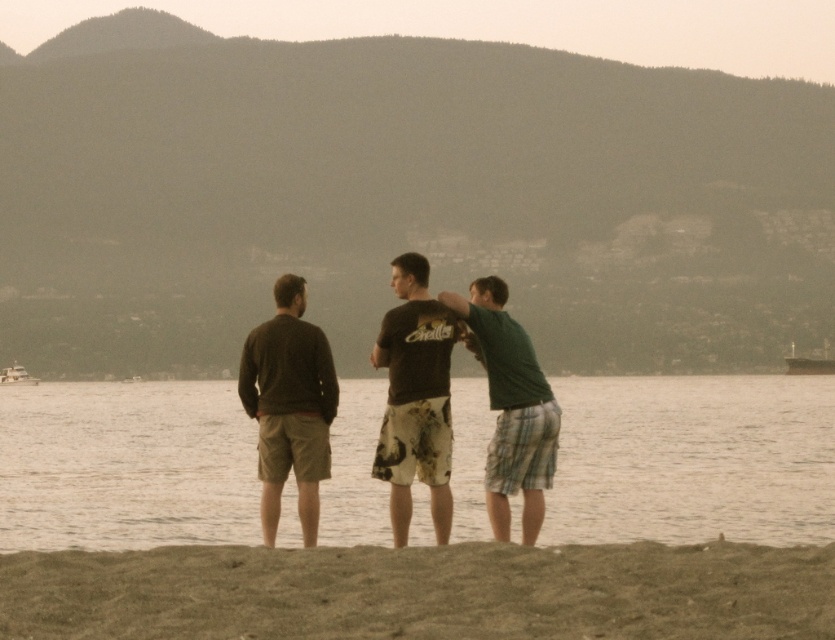
Looking at this image, is smooth water at center smaller than dark brown sweater at center?

Incorrect, smooth water at center is not smaller in size than dark brown sweater at center.

Does smooth water at center appear on the left side of dark brown sweater at center?

Yes, smooth water at center is to the left of dark brown sweater at center.

From the picture: Who is more distant from viewer, (x=735, y=500) or (x=301, y=364)?

Positioned behind is point (x=735, y=500).

Where is `smooth water at center`? The height and width of the screenshot is (640, 835). smooth water at center is located at coordinates (692, 460).

Who is more distant from viewer, (19, 433) or (444, 339)?

Positioned behind is point (19, 433).

Can you confirm if smooth water at center is wider than dark brown cotton t-shirt at center?

Yes.

Does point (347, 397) lie in front of point (423, 291)?

That is False.

Where is `smooth water at center`? The image size is (835, 640). smooth water at center is located at coordinates (692, 460).

You are a GUI agent. You are given a task and a screenshot of the screen. Output one action in this format:
    pyautogui.click(x=<x>, y=<y>)
    Task: Click on the smooth water at center
    
    Given the screenshot: What is the action you would take?
    pyautogui.click(x=692, y=460)

Who is higher up, smooth water at center or brown sandy beach at lower center?

Positioned higher is brown sandy beach at lower center.

This screenshot has width=835, height=640. What are the coordinates of `smooth water at center` in the screenshot? It's located at (692, 460).

Identify the location of smooth water at center. (692, 460).